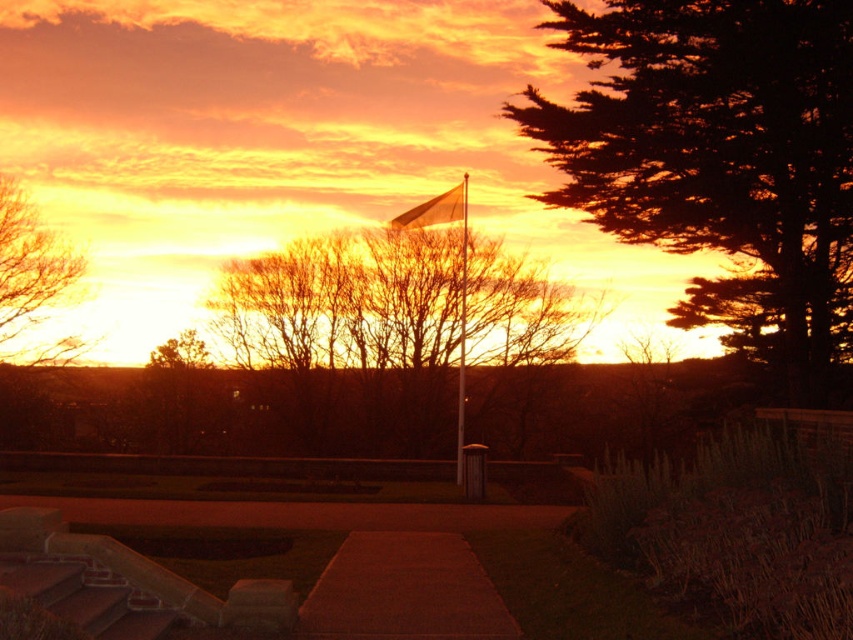
Question: Which point appears farthest from the camera in this image?

Choices:
 (A) (405, 227)
 (B) (792, 164)
 (C) (387, 260)

Answer: (C)

Question: Is silhouette evergreen tree at right thinner than brown leafless tree at upper left?

Choices:
 (A) no
 (B) yes

Answer: (A)

Question: Can you confirm if silhouette evergreen tree at right is smaller than bare branches at center?

Choices:
 (A) no
 (B) yes

Answer: (A)

Question: Can you confirm if bare branches at center is wider than metallic flag pole at center?

Choices:
 (A) no
 (B) yes

Answer: (B)

Question: Which object is the closest to the beige fabric flag at upper center?

Choices:
 (A) metallic flag pole at center
 (B) smooth brown mat at center
 (C) brown leafless tree at upper left

Answer: (A)

Question: Among these points, which one is farthest from the camera?

Choices:
 (A) (461, 480)
 (B) (775, 172)

Answer: (A)